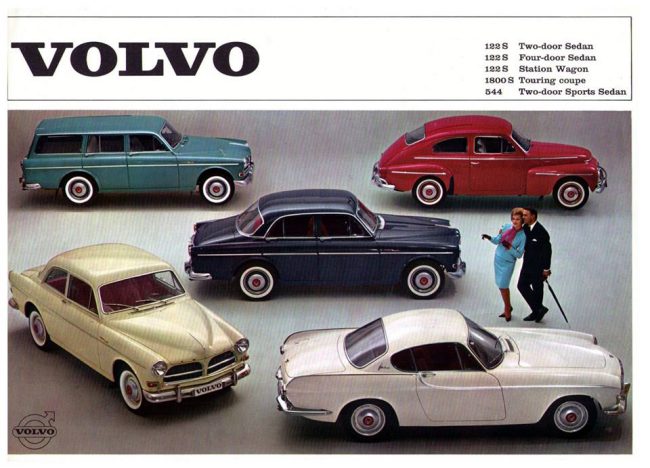
Image resolution: width=650 pixels, height=468 pixels. Find the location of `floor`. floor is located at coordinates (151, 232).